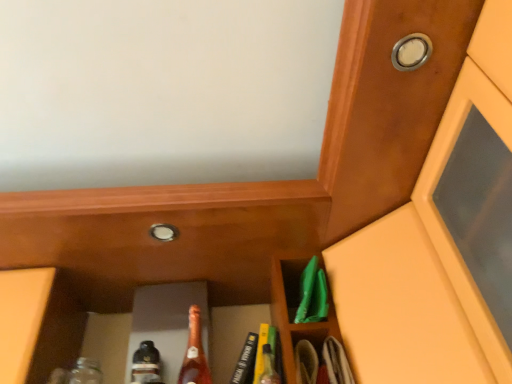
The height and width of the screenshot is (384, 512). Find the location of `free space in front of metallic silver knob at upper right, marked as the second knob in a bottom-to-top arrangement`. free space in front of metallic silver knob at upper right, marked as the second knob in a bottom-to-top arrangement is located at coordinates (420, 18).